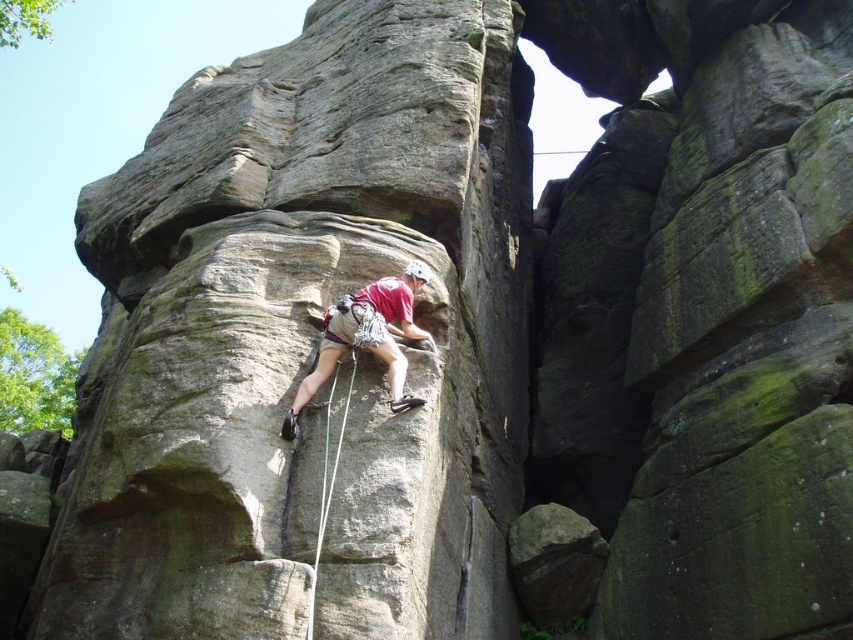
You are a safety inspector assessing the rock climber. You notice the matte gray rock climber at center and the white nylon rope at center. Which object is located to the right of the other?

The matte gray rock climber at center is positioned on the right side of white nylon rope at center, so the climber is to the right of the rope.

You are a drone operator tasked with capturing aerial footage of the matte gray rock climber at center. The drone must maintain a safety distance of at least 10 meters from the climber to avoid disturbing them. Given the climber is at coordinates point 0.528, 0.431, can you confirm if the drone is positioned safely?

The position of the matte gray rock climber at center is at point (367, 337). The drone must maintain a safety distance of at least 10 meters, but without knowing the drone coordinates, it is impossible to determine if the distance requirement is met.

You are a rock climber trying to reach the top of the cliff. You see a point marked at coordinates (367,337). What object is located at that point?

The point at coordinates (367,337) corresponds to the matte gray rock climber at center.